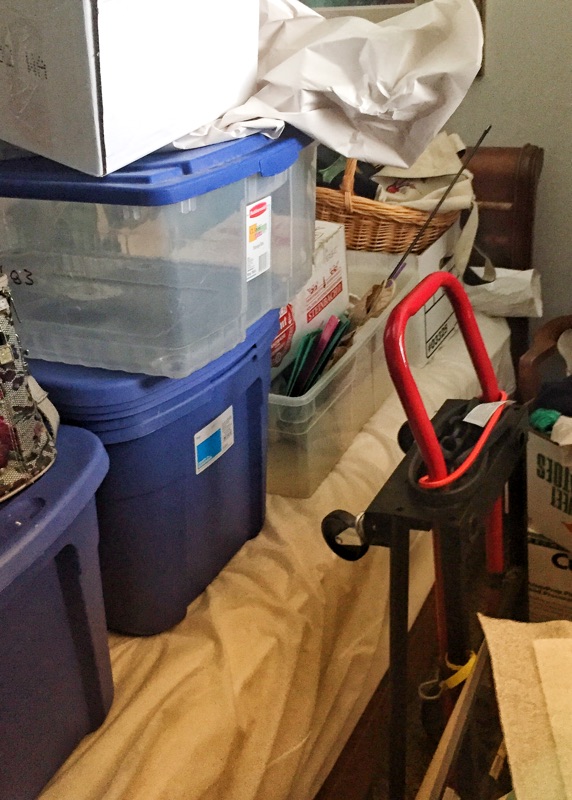
Identify the location of off-white wall. tap(513, 50).